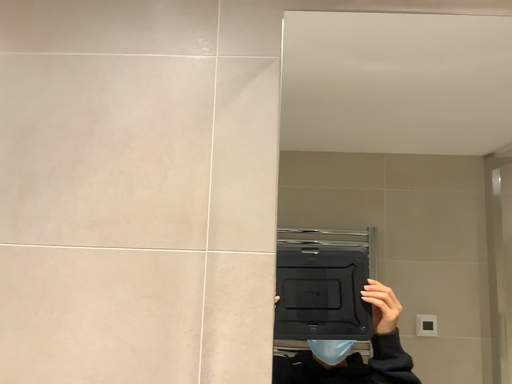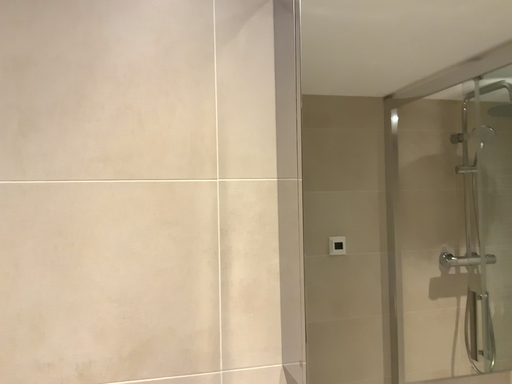
Question: Which way did the camera rotate in the video?

Choices:
 (A) rotated left
 (B) rotated right

Answer: (B)